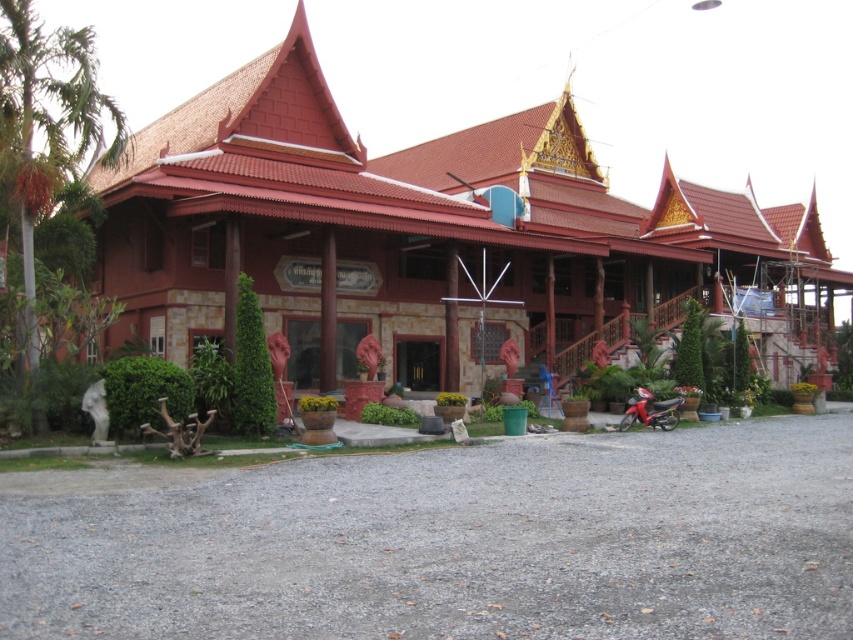
Question: Which object appears farthest from the camera in this image?

Choices:
 (A) green leafy palm tree at left
 (B) metallic red motorcycle at lower right

Answer: (B)

Question: Can you confirm if green leafy palm tree at left is bigger than metallic red motorcycle at lower right?

Choices:
 (A) no
 (B) yes

Answer: (B)

Question: From the image, what is the correct spatial relationship of green leafy palm tree at left in relation to metallic red motorcycle at lower right?

Choices:
 (A) below
 (B) above

Answer: (B)

Question: Is green leafy palm tree at left thinner than metallic red motorcycle at lower right?

Choices:
 (A) no
 (B) yes

Answer: (A)